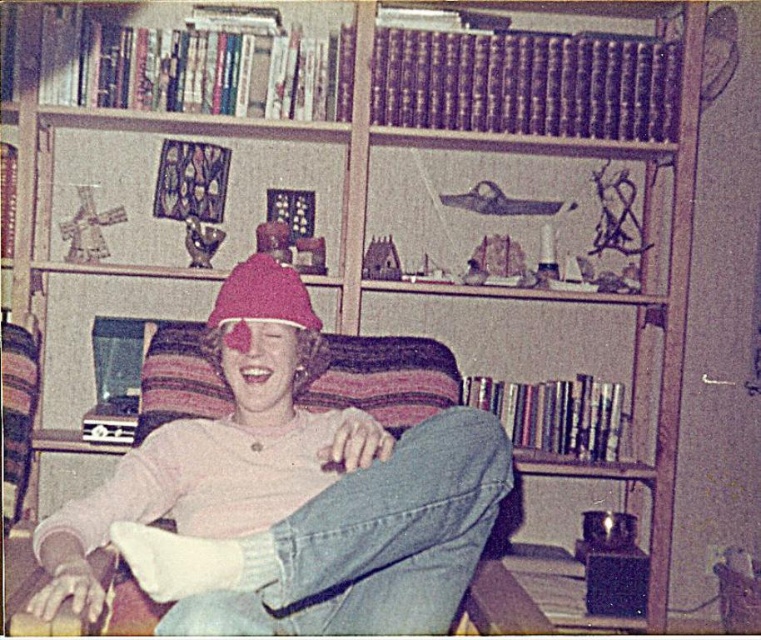
Question: Among these points, which one is farthest from the camera?

Choices:
 (A) (252, 516)
 (B) (291, 275)

Answer: (B)

Question: Which point appears closest to the camera in this image?

Choices:
 (A) (443, 481)
 (B) (225, 317)

Answer: (A)

Question: Does pink matte hat at center have a larger size compared to fuzzy pink beanie at center?

Choices:
 (A) yes
 (B) no

Answer: (A)

Question: Is pink matte hat at center smaller than fuzzy pink beanie at center?

Choices:
 (A) no
 (B) yes

Answer: (A)

Question: Does pink matte hat at center appear under fuzzy pink beanie at center?

Choices:
 (A) yes
 (B) no

Answer: (A)